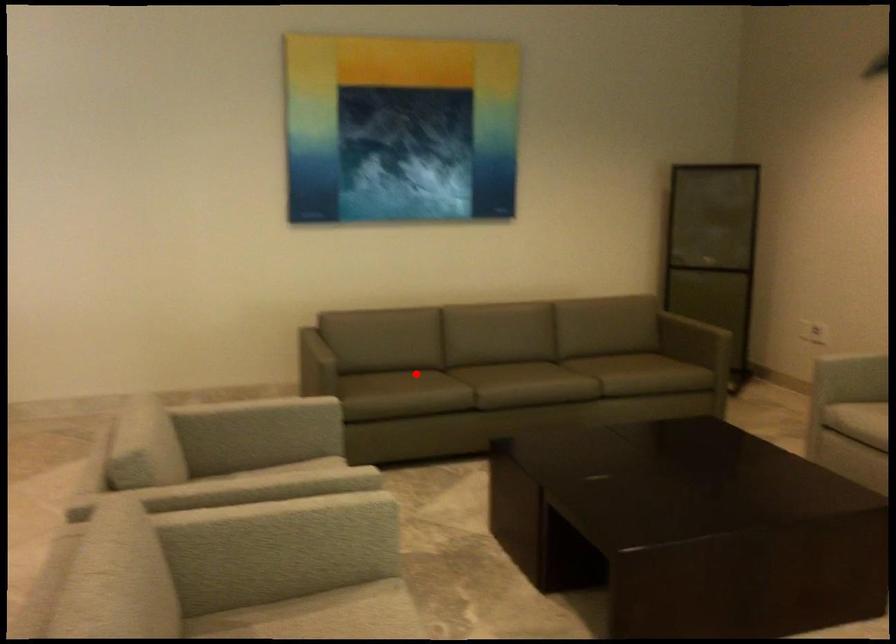
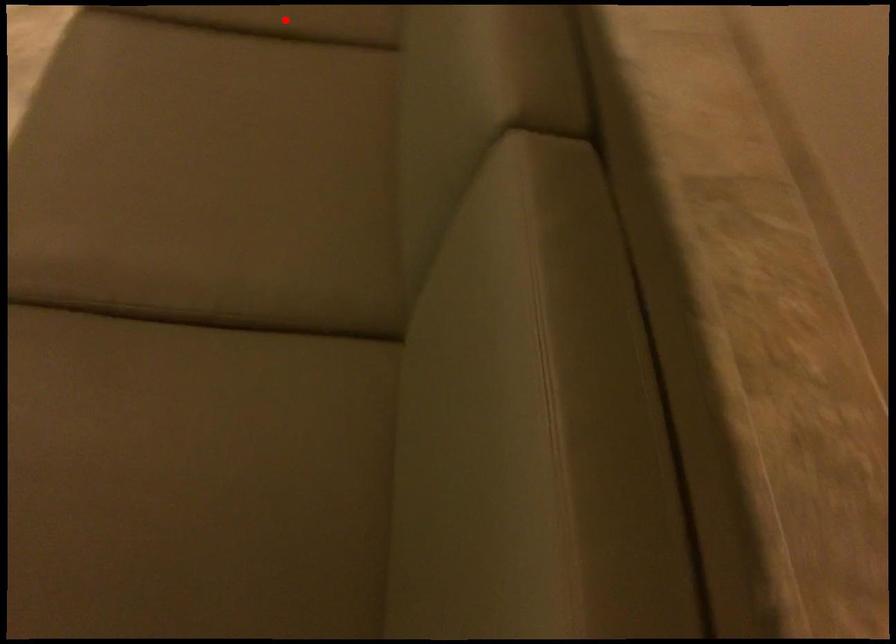
I am providing you with two images of the same scene from different viewpoints. A red point is marked on the first image and another point is marked on the second image. Are the points marked in image1 and image2 representing the same 3D position?

Yes